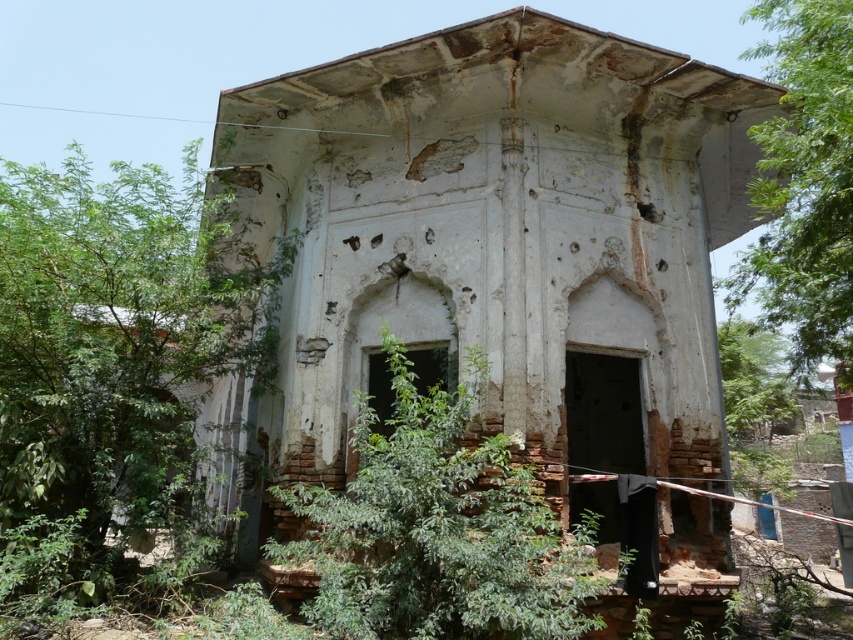
Between white weathered wall at center and green leafy tree at left, which one is positioned lower?

white weathered wall at center

Is white weathered wall at center above green leafy tree at left?

Actually, white weathered wall at center is below green leafy tree at left.

Is point (422, 116) positioned behind point (57, 321)?

Yes.

Where is `white weathered wall at center`? The image size is (853, 640). white weathered wall at center is located at coordinates (503, 273).

Which is more to the left, white weathered wall at center or green leafy tree at upper right?

white weathered wall at center is more to the left.

Between white weathered wall at center and green leafy tree at upper right, which one is positioned lower?

Positioned lower is white weathered wall at center.

Locate an element on the screen. This screenshot has width=853, height=640. white weathered wall at center is located at coordinates (503, 273).

Between green leafy tree at center and green leafy tree at upper right, which one appears on the right side from the viewer's perspective?

green leafy tree at upper right

Between point (585, 614) and point (792, 353), which one is positioned behind?

The point (792, 353) is more distant.

Is point (410, 520) farther from camera compared to point (845, 145)?

No.

Identify the location of green leafy tree at center. This screenshot has width=853, height=640. (438, 531).